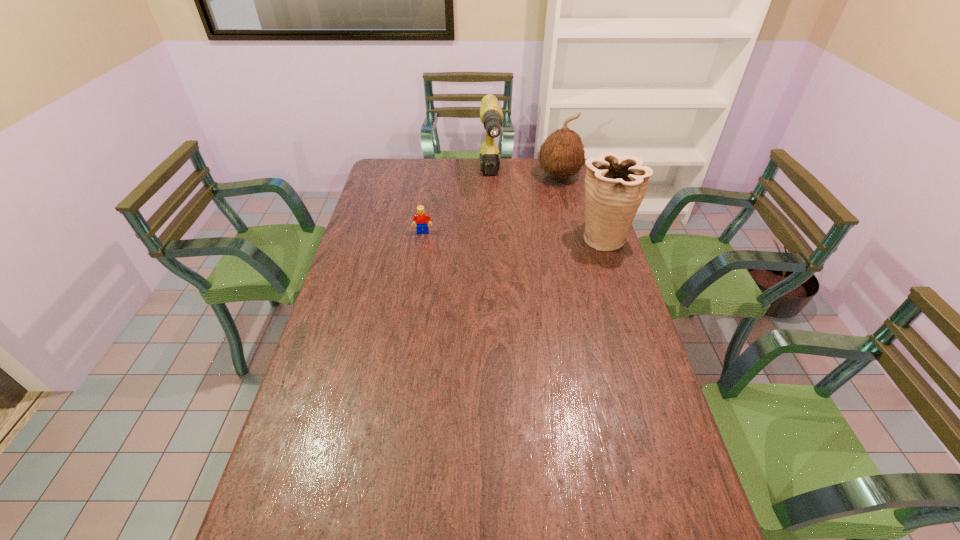
Locate an element on the screen. The width and height of the screenshot is (960, 540). vacant space on the desktop that is between the Lego and the urn and is positioned on the handle side of the drill is located at coordinates (497, 234).

Locate an element on the screen. This screenshot has height=540, width=960. vacant spot on the desktop that is between the leftmost object and the urn and is positioned on the surface of the coconut is located at coordinates (537, 236).